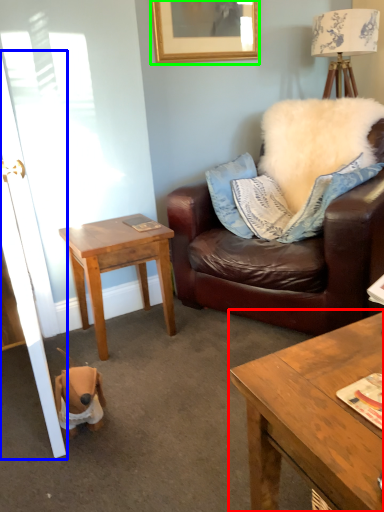
Question: Which object is positioned farthest from coffee table (highlighted by a red box)? Select from door (highlighted by a blue box) and picture frame (highlighted by a green box).

Choices:
 (A) door
 (B) picture frame

Answer: (B)